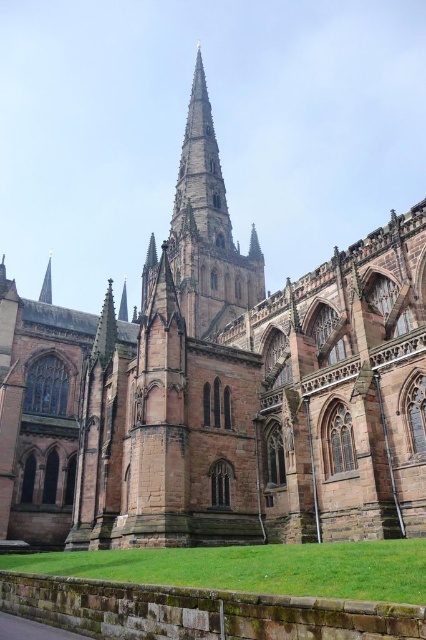
You are an architect analyzing the cathedral design. You notice two spires in the image. Which one is taller between the brown stone spire at center and the smooth stone spire at upper center?

The brown stone spire at center is much taller than the smooth stone spire at upper center.

You are an architect examining the cathedral and notice two spires. The brown stone spire at center and the smooth stone spire at upper center. Which spire is located higher up on the cathedral?

The smooth stone spire at upper center is higher up because the brown stone spire at center is positioned over it.